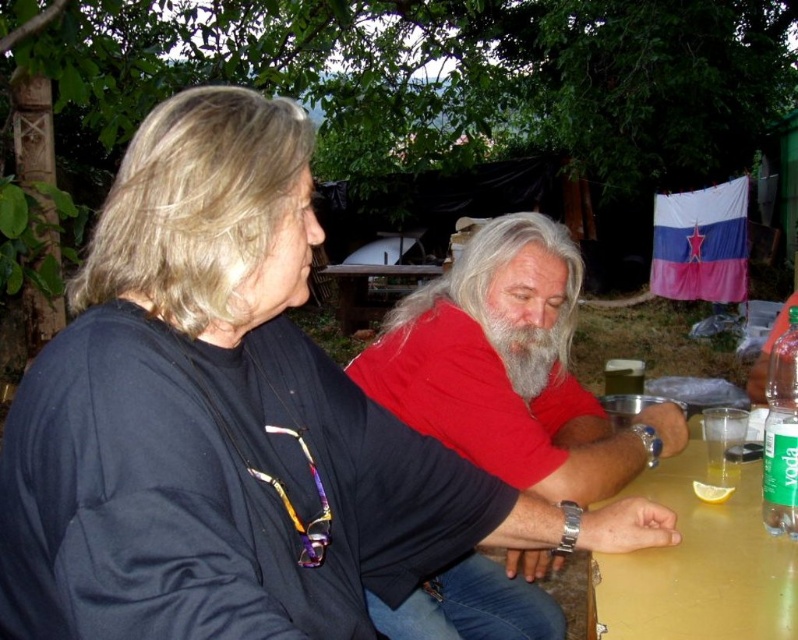
Question: Which point is closer to the camera?

Choices:
 (A) graywoollybeard at center
 (B) clear glass at table right
 (C) yellow citrus slice at table right

Answer: (C)

Question: Is graywoollybeard at center smaller than wooden table at center?

Choices:
 (A) yes
 (B) no

Answer: (A)

Question: Is green plastic bottle at right above wooden table at center?

Choices:
 (A) yes
 (B) no

Answer: (B)

Question: Which point is closer to the camera?

Choices:
 (A) black matte shirt at upper left
 (B) green plastic bottle at right

Answer: (A)

Question: Estimate the real-world distances between objects in this image. Which object is closer to the black matte shirt at upper left?

Choices:
 (A) graywoollybeard at center
 (B) yellow citrus slice at table right
 (C) green plastic bottle at right
 (D) clear glass at table right

Answer: (C)

Question: Is red matte shirt at center to the left of yellow citrus slice at table right from the viewer's perspective?

Choices:
 (A) no
 (B) yes

Answer: (B)